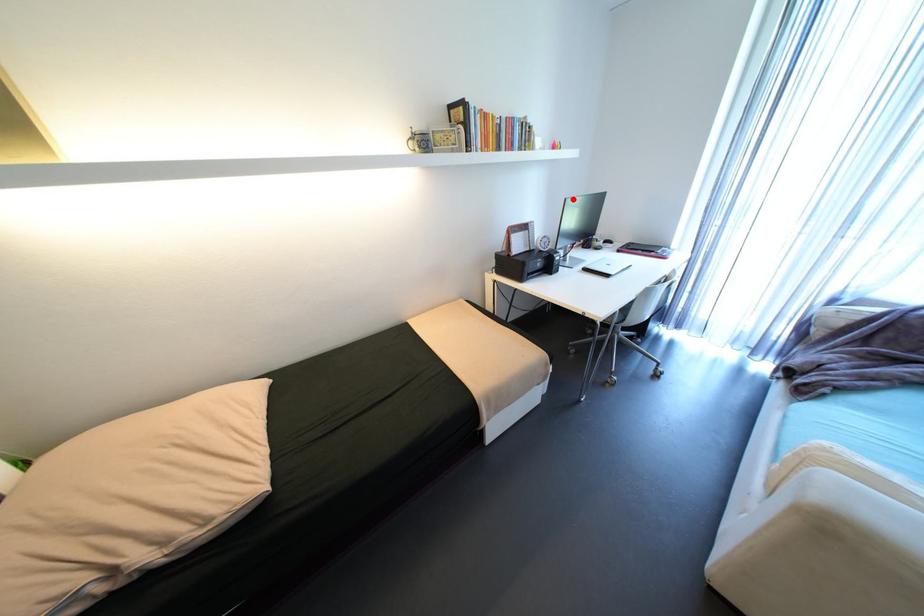
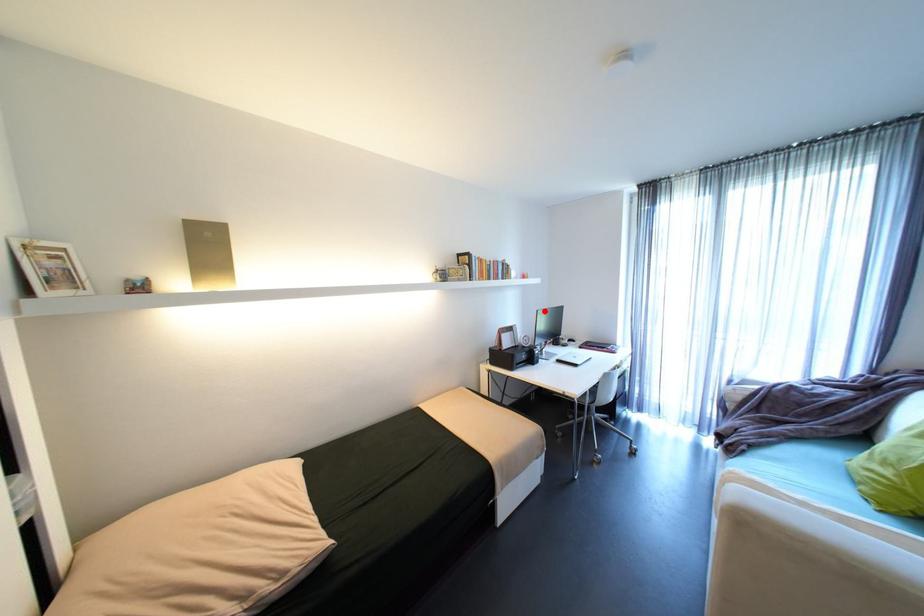
I am providing you with two images of the same scene from different viewpoints. A red point is marked on the first image and another point is marked on the second image. Do the highlighted points in image1 and image2 indicate the same real-world spot?

Yes